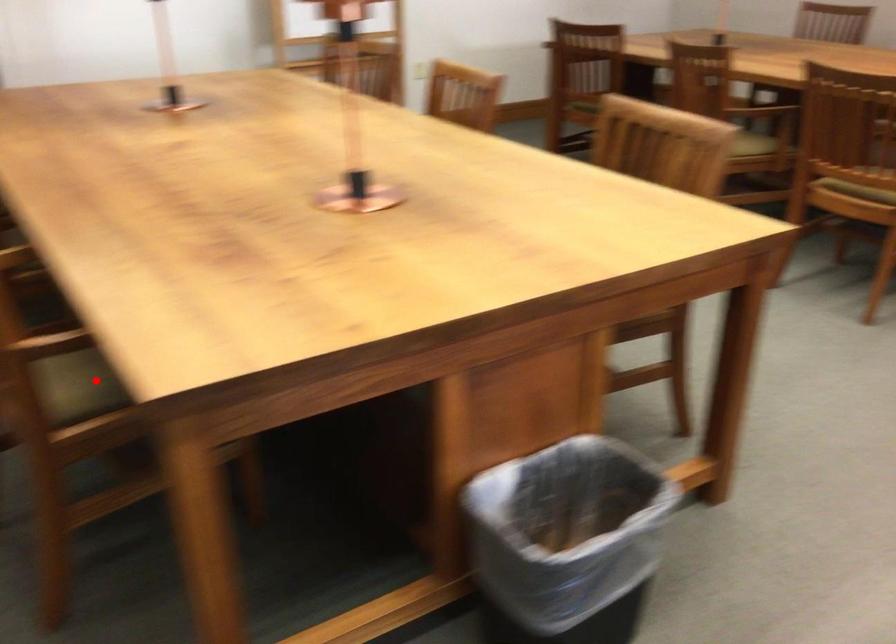
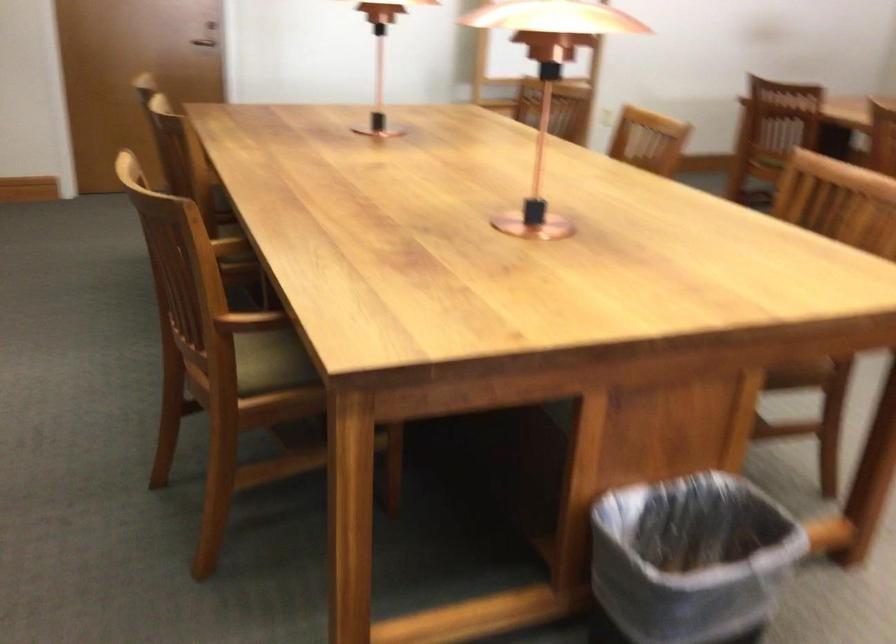
Question: I am providing you with two images of the same scene from different viewpoints. Given a red point in image1, look at the same physical point in image2. Is it:

Choices:
 (A) Closer to the viewpoint
 (B) Farther from the viewpoint

Answer: (B)